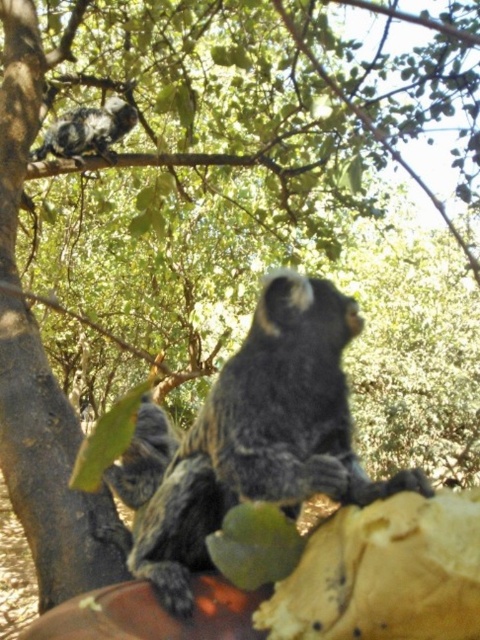
You are a photographer trying to capture the dark gray fur monkey at center without the green matte leaf at lower center blocking the view. Given their sizes, do you think the leaf can fully cover the monkey in the photo?

The green matte leaf at lower center has a lesser width compared to dark gray fur monkey at center, so the leaf cannot fully cover the monkey in the photo since it is smaller in width.

You are a photographer trying to capture both monkeys in the scene. You notice two points marked in the image. The first point is at coordinate point (x=263, y=468) and the second is at point (x=143, y=483). Which point is closer to the camera so you can focus your lens properly?

Point (x=263, y=468) is closer to the camera than point (x=143, y=483), so focus your lens on that point first.